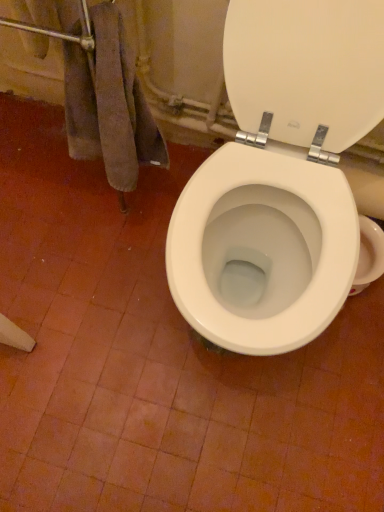
The width and height of the screenshot is (384, 512). What do you see at coordinates (306, 68) in the screenshot? I see `white glossy toilet seat at upper right` at bounding box center [306, 68].

Where is `white glossy toilet seat at upper right`? This screenshot has height=512, width=384. white glossy toilet seat at upper right is located at coordinates (306, 68).

Find the location of `white glossy toilet seat at upper right`. white glossy toilet seat at upper right is located at coordinates (306, 68).